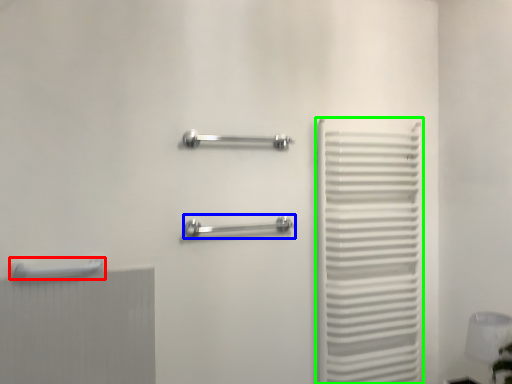
Question: Which object is the farthest from towel rack (highlighted by a red box)? Choose among these: towel rack (highlighted by a blue box) or curtain (highlighted by a green box).

Choices:
 (A) towel rack
 (B) curtain

Answer: (B)